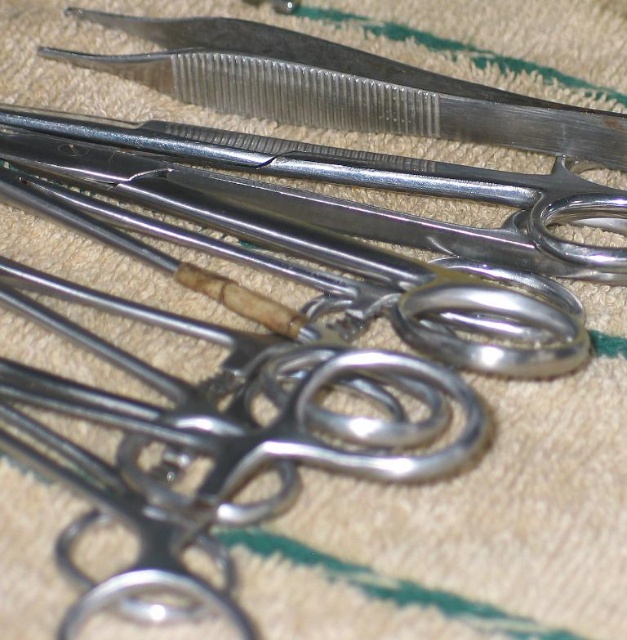
Question: Among these points, which one is nearest to the camera?

Choices:
 (A) (140, 17)
 (B) (226, 145)

Answer: (B)

Question: Does polished metal scissors at center have a smaller size compared to metallic shears at center?

Choices:
 (A) yes
 (B) no

Answer: (A)

Question: Which object is closer to the camera taking this photo?

Choices:
 (A) metallic shears at center
 (B) polished metal scissors at center

Answer: (B)

Question: Is polished metal scissors at center below metallic shears at center?

Choices:
 (A) yes
 (B) no

Answer: (A)

Question: Can you confirm if polished metal scissors at center is positioned to the left of metallic shears at center?

Choices:
 (A) yes
 (B) no

Answer: (A)